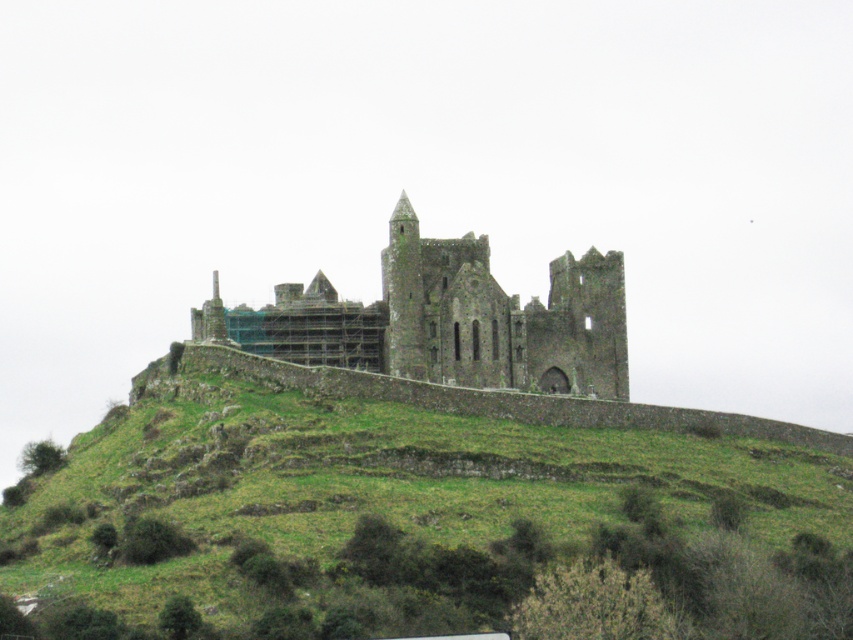
You are a hiker who wants to reach the rusty stone castle at center from the green grassy hillside at center. Considering the size difference between them, which one would you need to traverse first?

The green grassy hillside at center is larger in size than the rusty stone castle at center, so you would need to traverse the green grassy hillside at center first before reaching the castle.